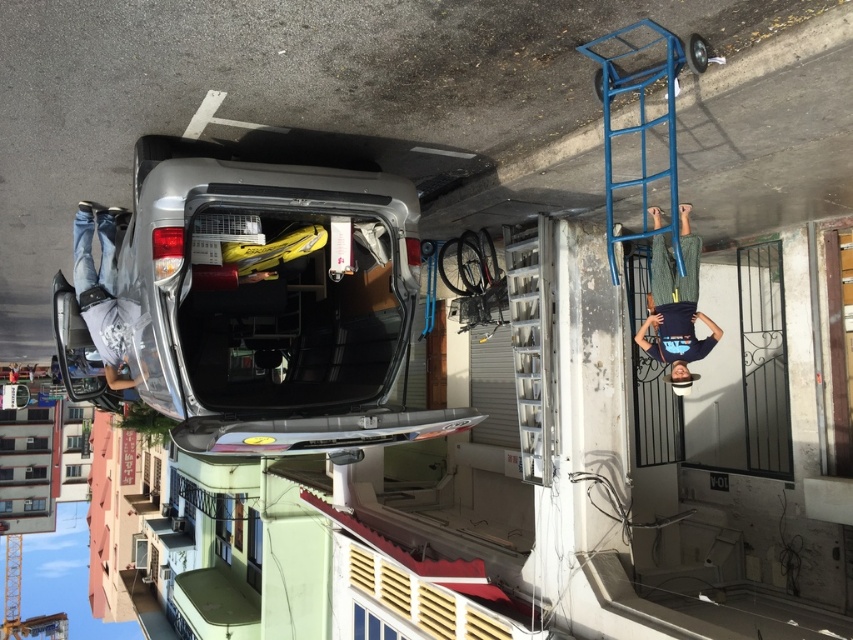
Who is higher up, dark green knitted sweater at upper right or jeans at left?

dark green knitted sweater at upper right

This screenshot has height=640, width=853. In order to click on dark green knitted sweater at upper right in this screenshot , I will do `click(676, 305)`.

Does point (637, 342) come farther from viewer compared to point (109, 305)?

Yes, point (637, 342) is farther from viewer.

You are a GUI agent. You are given a task and a screenshot of the screen. Output one action in this format:
    pyautogui.click(x=<x>, y=<y>)
    Task: Click on the dark green knitted sweater at upper right
    The image size is (853, 640).
    Given the screenshot: What is the action you would take?
    pyautogui.click(x=676, y=305)

Between satin silver car at center and dark green knitted sweater at upper right, which one is positioned higher?

dark green knitted sweater at upper right is higher up.

Who is positioned more to the left, satin silver car at center or dark green knitted sweater at upper right?

satin silver car at center

Between point (322, 390) and point (700, 342), which one is positioned behind?

Point (700, 342)

Where is `satin silver car at center`? This screenshot has width=853, height=640. satin silver car at center is located at coordinates click(x=274, y=300).

Can you confirm if satin silver car at center is wider than jeans at left?

Yes, satin silver car at center is wider than jeans at left.

Does satin silver car at center appear on the right side of jeans at left?

Correct, you'll find satin silver car at center to the right of jeans at left.

Where is `satin silver car at center`? This screenshot has height=640, width=853. satin silver car at center is located at coordinates (274, 300).

Identify the location of satin silver car at center. (274, 300).